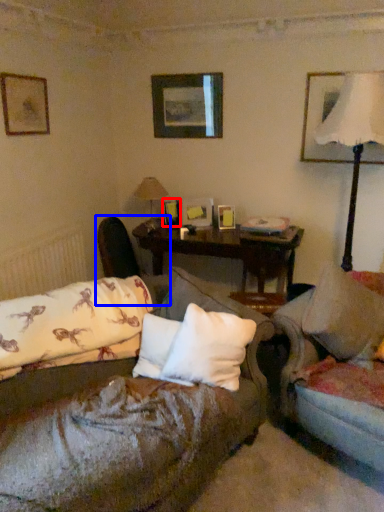
Question: Which point is further to the camera, picture frame (highlighted by a red box) or swivel chair (highlighted by a blue box)?

Choices:
 (A) picture frame
 (B) swivel chair

Answer: (A)